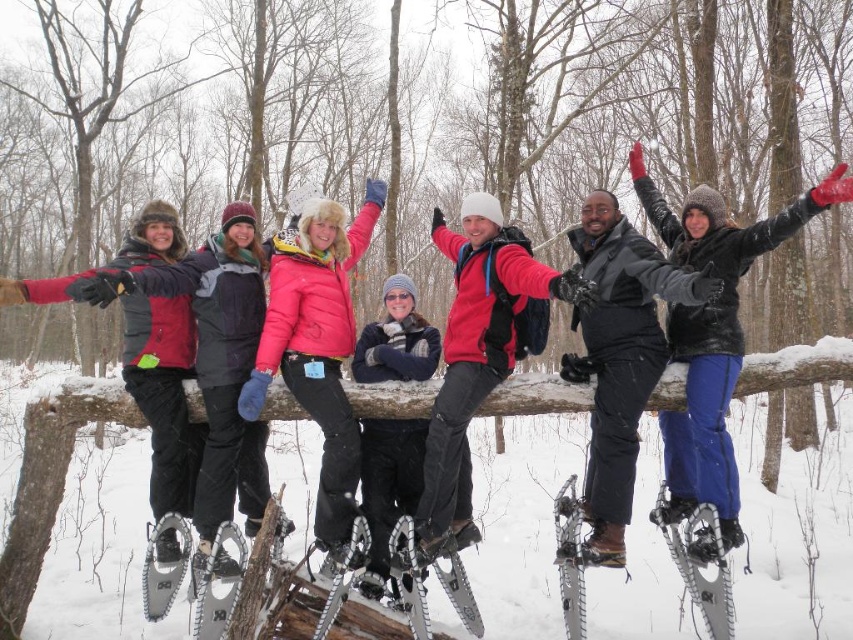
Question: Among these objects, which one is farthest from the camera?

Choices:
 (A) pink matte jacket at center
 (B) black matte snowshoes at center

Answer: (A)

Question: Among these objects, which one is farthest from the camera?

Choices:
 (A) matte red jacket at center
 (B) pink matte jacket at center
 (C) black woolen scarf at center

Answer: (A)

Question: Can you confirm if pink matte jacket at center is wider than black woolen scarf at center?

Choices:
 (A) no
 (B) yes

Answer: (B)

Question: Can you confirm if black matte snowshoes at center is wider than pink matte jacket at center?

Choices:
 (A) no
 (B) yes

Answer: (A)

Question: Estimate the real-world distances between objects in this image. Which object is farther from the pink matte jacket at center?

Choices:
 (A) black matte snowshoes at center
 (B) white fluffy snow at center
 (C) matte red jacket at center

Answer: (B)

Question: Is matte red jacket at center below black matte snowshoes at center?

Choices:
 (A) yes
 (B) no

Answer: (A)